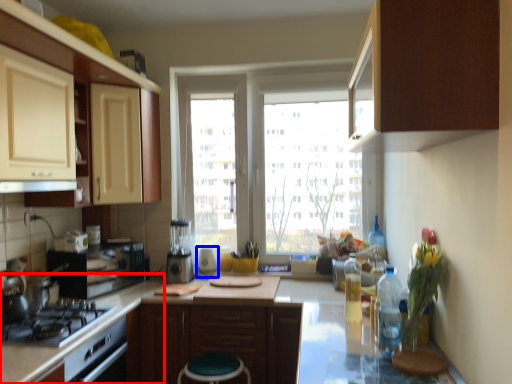
Question: Among these objects, which one is nearest to the camera, counter top (highlighted by a red box) or appliance (highlighted by a blue box)?

Choices:
 (A) counter top
 (B) appliance

Answer: (A)